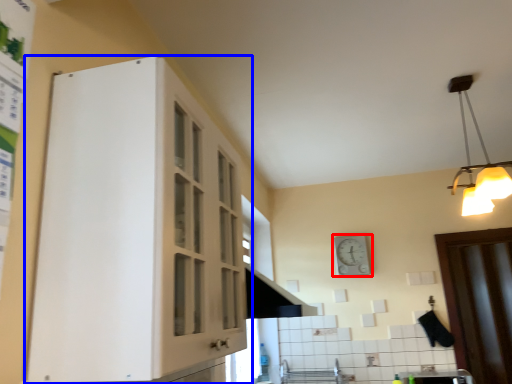
Question: Which of the following is the farthest to the observer, clock (highlighted by a red box) or cabinetry (highlighted by a blue box)?

Choices:
 (A) clock
 (B) cabinetry

Answer: (A)